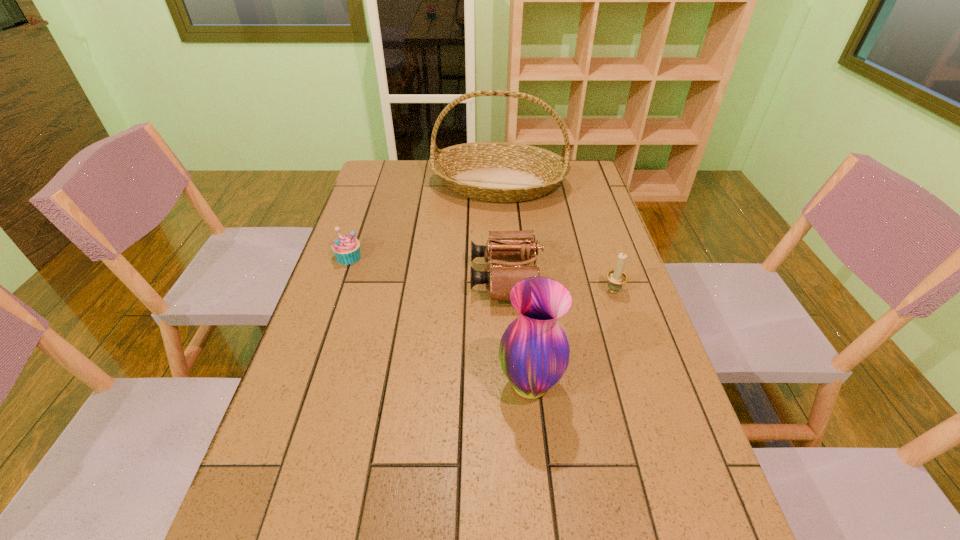
This screenshot has height=540, width=960. What are the coordinates of `candle_holder at the right edge` in the screenshot? It's located at (616, 277).

Find the location of a particular element. The image size is (960, 540). object present at the far right corner is located at coordinates (504, 172).

Where is `vacant space at the far edge`? Image resolution: width=960 pixels, height=540 pixels. vacant space at the far edge is located at coordinates (411, 185).

Image resolution: width=960 pixels, height=540 pixels. Identify the location of vacant region at the left edge of the desktop. (362, 232).

I want to click on vacant area at the right edge of the desktop, so click(x=676, y=415).

Locate an element on the screen. vacant area that lies between the basket and the muffin is located at coordinates (423, 220).

Locate an element on the screen. This screenshot has height=540, width=960. free area in between the shortest object and the binoculars is located at coordinates (427, 267).

Where is `free space that is in between the rightmost object and the farthest object`? This screenshot has height=540, width=960. free space that is in between the rightmost object and the farthest object is located at coordinates tap(556, 237).

The width and height of the screenshot is (960, 540). I want to click on vacant area that lies between the binoculars and the leftmost object, so click(427, 267).

Identify the location of object that is the fourth closest to the muffin. (616, 277).